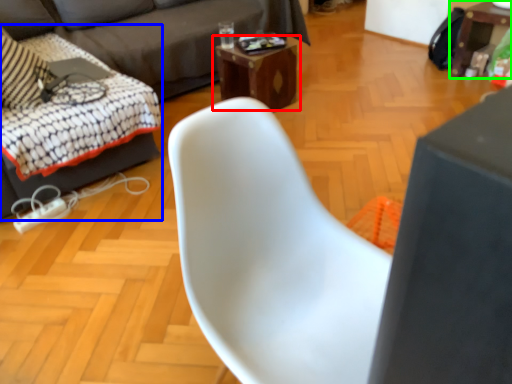
Question: Which object is the farthest from table (highlighted by a red box)? Choose among these: swivel chair (highlighted by a blue box) or table (highlighted by a green box).

Choices:
 (A) swivel chair
 (B) table

Answer: (B)